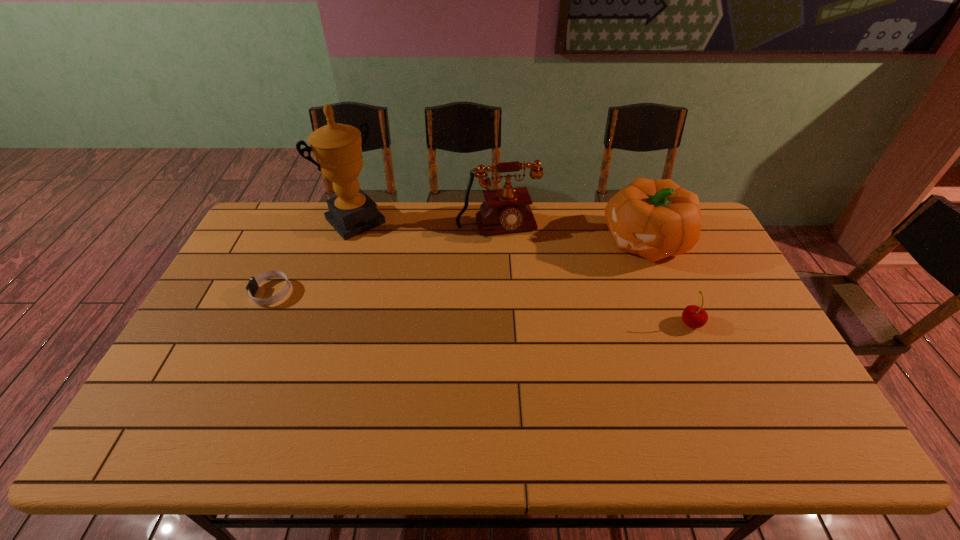
Locate an element on the screen. This screenshot has width=960, height=540. vacant space on the desktop that is between the second nearest object and the cherry and is positioned at the front of the award with handles is located at coordinates (437, 305).

This screenshot has height=540, width=960. Identify the location of free space on the desktop that is between the wristband and the cherry and is positioned on the carved face of the pumpkin. (511, 310).

Locate an element on the screen. The width and height of the screenshot is (960, 540). free space on the desktop that is between the second nearest object and the fourth tallest object and is positioned on the dial of the telephone is located at coordinates (522, 311).